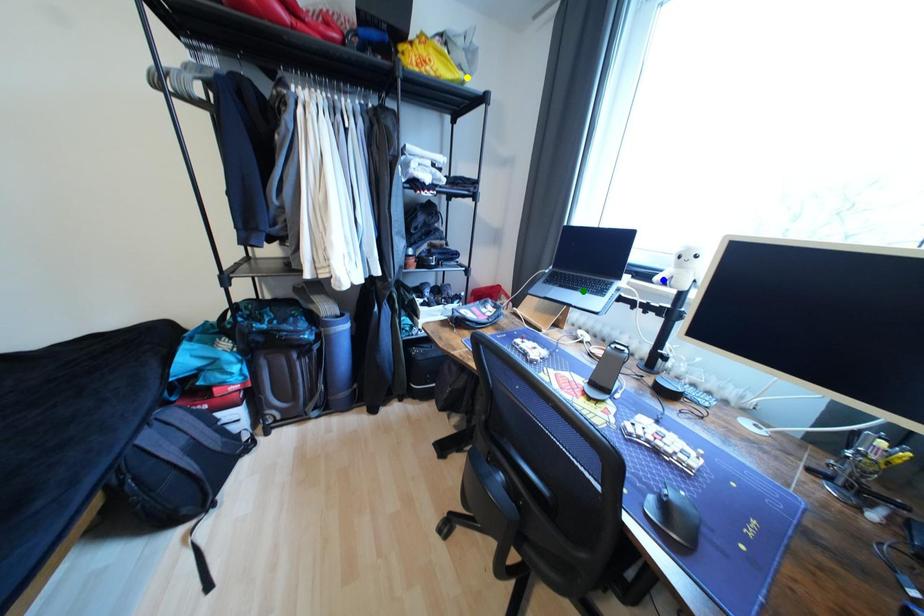
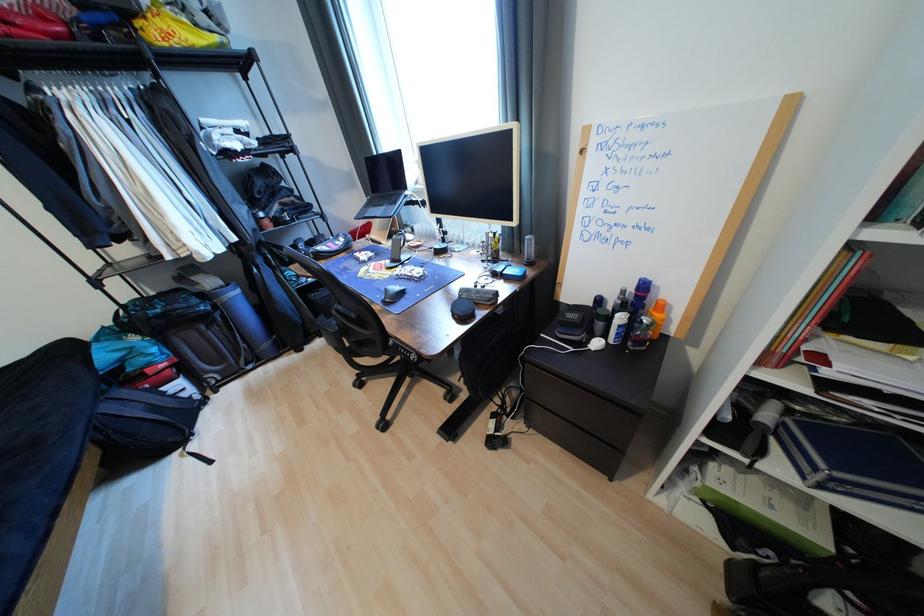
I am providing you with two images of the same scene from different viewpoints. Three points are marked in image1. Which point corresponds to a part or object that is occluded in image2?In image1, three points are marked. Which of them correspond to a part or object that is occluded in image2?Among the three points shown in image1, which one corresponds to a part or object that is no longer visible due to occlusion in image2?

Invisible in image2: blue point.